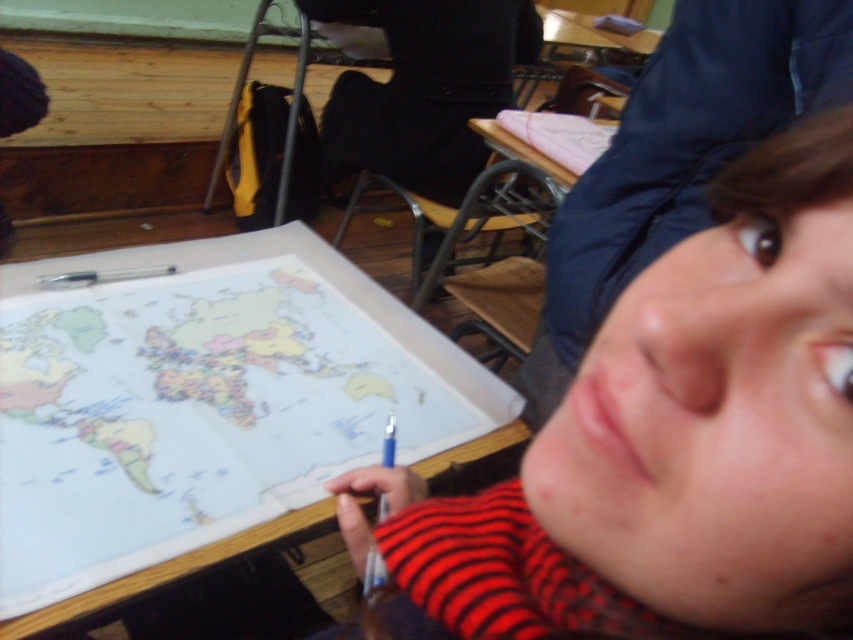
In the scene shown: You are a student sitting at the desk in the classroom. You notice two points on the map you are looking at. The first point is at coordinates point [643,253] and the second is at point [192,554]. Which point is closer to you?

Point [643,253] is closer to you because it is further to the viewer than point [192,554].

In the classroom scene, you see a striped sweater at center and a smooth skin face at upper right. Which object takes up more space in the image?

The smooth skin face at upper right takes up more space in the image because the striped sweater at center is smaller than it.